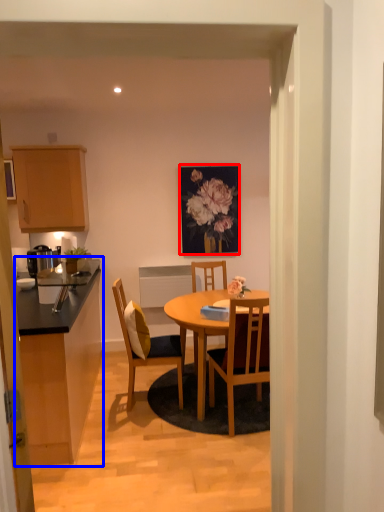
Question: Which of the following is the farthest to the observer, picture frame (highlighted by a red box) or cabinetry (highlighted by a blue box)?

Choices:
 (A) picture frame
 (B) cabinetry

Answer: (A)